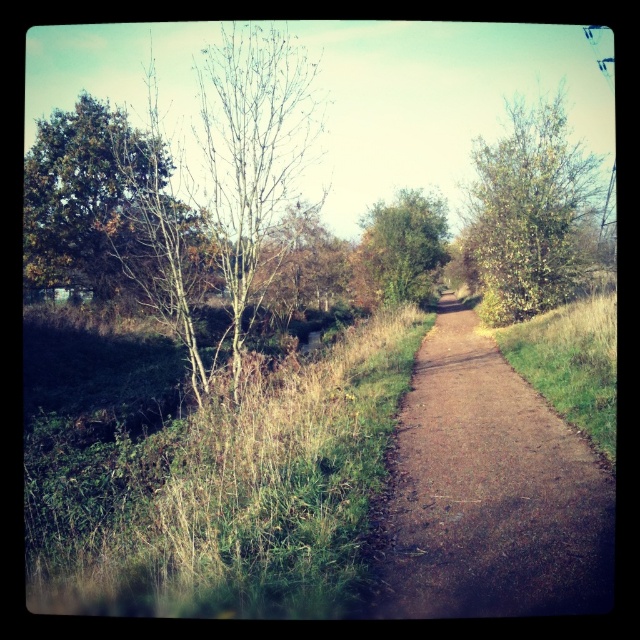
Is brown gravel path at center smaller than green leafy tree at upper right?

Yes, brown gravel path at center is smaller than green leafy tree at upper right.

Which is below, brown gravel path at center or green leafy tree at upper right?

brown gravel path at center

Between point (444, 451) and point (593, 157), which one is positioned behind?

Point (593, 157)

Where is `brown gravel path at center`? This screenshot has width=640, height=640. brown gravel path at center is located at coordinates (490, 492).

The width and height of the screenshot is (640, 640). What do you see at coordinates (490, 492) in the screenshot?
I see `brown gravel path at center` at bounding box center [490, 492].

What are the coordinates of `brown gravel path at center` in the screenshot? It's located at (490, 492).

Who is positioned more to the left, brown gravel path at center or green leafy tree at center?

brown gravel path at center is more to the left.

Is brown gravel path at center further to the viewer compared to green leafy tree at center?

That is False.

Between point (593, 548) and point (428, 300), which one is positioned behind?

The point (428, 300) is more distant.

Locate an element on the screen. The width and height of the screenshot is (640, 640). brown gravel path at center is located at coordinates point(490,492).